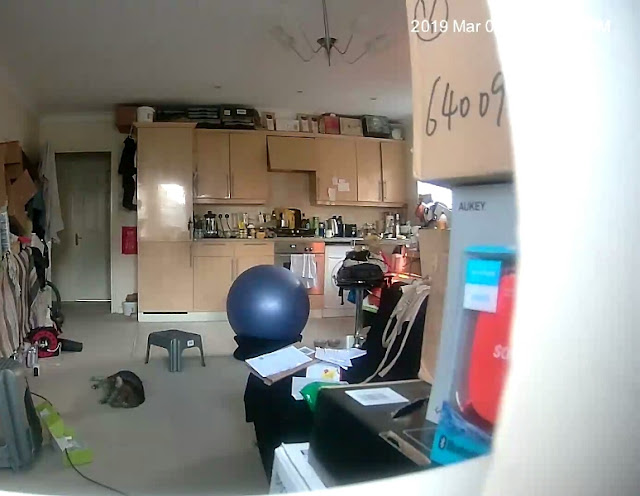
Locate an element on the screen. This screenshot has height=496, width=640. ceiling fan is located at coordinates click(x=328, y=43).